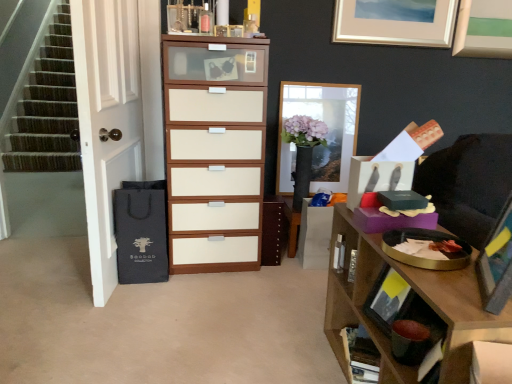
Question: From a real-world perspective, is white glossy door at left on wooden bookshelf at lower right?

Choices:
 (A) no
 (B) yes

Answer: (B)

Question: Is wooden bookshelf at lower right completely or partially inside white glossy door at left?

Choices:
 (A) no
 (B) yes

Answer: (A)

Question: Can you confirm if white glossy door at left is wider than wooden bookshelf at lower right?

Choices:
 (A) yes
 (B) no

Answer: (A)

Question: Can you confirm if white glossy door at left is thinner than wooden bookshelf at lower right?

Choices:
 (A) yes
 (B) no

Answer: (B)

Question: Does white glossy door at left lie in front of wooden bookshelf at lower right?

Choices:
 (A) yes
 (B) no

Answer: (B)

Question: From the image's perspective, relative to matte white wood chest of drawers at center, is wooden picture frame at right, which is counted as the third picture frame, starting from the top, above or below?

Choices:
 (A) below
 (B) above

Answer: (A)

Question: Is wooden picture frame at right, marked as the 1th picture frame in a bottom-to-top arrangement, wider or thinner than matte white wood chest of drawers at center?

Choices:
 (A) wide
 (B) thin

Answer: (B)

Question: Is wooden picture frame at right, which is counted as the third picture frame, starting from the top, in front of or behind matte white wood chest of drawers at center in the image?

Choices:
 (A) front
 (B) behind

Answer: (A)

Question: From their relative heights in the image, would you say wooden picture frame at right, placed as the third picture frame when sorted from back to front, is taller or shorter than matte white wood chest of drawers at center?

Choices:
 (A) short
 (B) tall

Answer: (A)

Question: From the image's perspective, relative to matte black drawer at upper right, is brown wood cabinet at center above or below?

Choices:
 (A) below
 (B) above

Answer: (A)

Question: Is point (267, 236) closer or farther from the camera than point (355, 210)?

Choices:
 (A) closer
 (B) farther

Answer: (B)

Question: In terms of height, does brown wood cabinet at center look taller or shorter compared to matte black drawer at upper right?

Choices:
 (A) short
 (B) tall

Answer: (B)

Question: Based on their sizes in the image, would you say brown wood cabinet at center is bigger or smaller than matte black drawer at upper right?

Choices:
 (A) small
 (B) big

Answer: (B)

Question: Looking at the image, does matte black drawer at upper right seem bigger or smaller compared to matte silver picture frame at upper center, the second picture frame in the front-to-back sequence?

Choices:
 (A) big
 (B) small

Answer: (B)

Question: Choose the correct answer: Is matte black drawer at upper right inside matte silver picture frame at upper center, arranged as the third picture frame when ordered from the bottom, or outside it?

Choices:
 (A) outside
 (B) inside

Answer: (A)